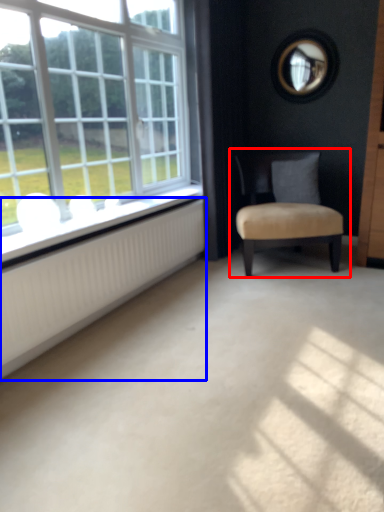
Question: Which of the following is the farthest to the observer, chair (highlighted by a red box) or radiator (highlighted by a blue box)?

Choices:
 (A) chair
 (B) radiator

Answer: (A)